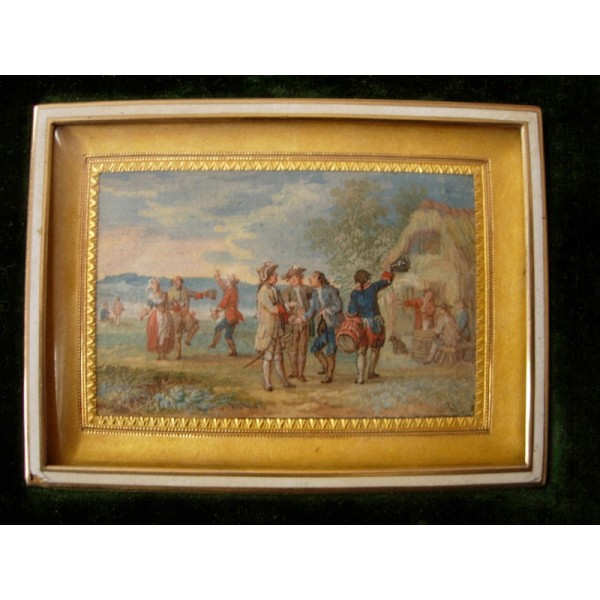
At what (x,y) coordinates should I click in order to perform the action: click on bench. Please return your answer as a coordinate pair (x, y). Image resolution: width=600 pixels, height=600 pixels. Looking at the image, I should click on (457, 353).